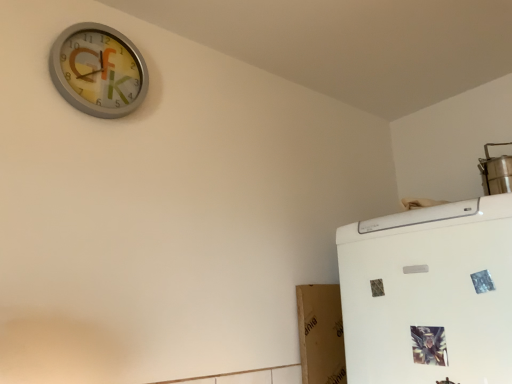
Describe the element at coordinates (98, 70) in the screenshot. This screenshot has width=512, height=384. I see `metallic silver clock at upper left` at that location.

At what (x,y) coordinates should I click in order to perform the action: click on metallic silver clock at upper left. Please return your answer as a coordinate pair (x, y). The height and width of the screenshot is (384, 512). Looking at the image, I should click on (98, 70).

Measure the distance between stainless steel steamer at upper right and camera.

A distance of 1.29 meters exists between stainless steel steamer at upper right and camera.

Locate an element on the screen. stainless steel steamer at upper right is located at coordinates (496, 172).

What do you see at coordinates (496, 172) in the screenshot? I see `stainless steel steamer at upper right` at bounding box center [496, 172].

Find the location of a particular element. metallic silver clock at upper left is located at coordinates (98, 70).

Between stainless steel steamer at upper right and metallic silver clock at upper left, which one appears on the right side from the viewer's perspective?

stainless steel steamer at upper right is more to the right.

Is stainless steel steamer at upper right in front of or behind metallic silver clock at upper left in the image?

In the image, stainless steel steamer at upper right appears behind metallic silver clock at upper left.

Considering the positions of points (498, 185) and (76, 58), is point (498, 185) farther from camera compared to point (76, 58)?

That is True.

From the image's perspective, which is above, stainless steel steamer at upper right or metallic silver clock at upper left?

metallic silver clock at upper left is shown above in the image.

From a real-world perspective, which is physically above, stainless steel steamer at upper right or metallic silver clock at upper left?

metallic silver clock at upper left.

Which object is thinner, stainless steel steamer at upper right or metallic silver clock at upper left?

metallic silver clock at upper left is thinner.

Considering the sizes of objects stainless steel steamer at upper right and metallic silver clock at upper left in the image provided, who is taller, stainless steel steamer at upper right or metallic silver clock at upper left?

With more height is metallic silver clock at upper left.

Who is bigger, stainless steel steamer at upper right or metallic silver clock at upper left?

With larger size is stainless steel steamer at upper right.

Is stainless steel steamer at upper right completely or partially outside of metallic silver clock at upper left?

stainless steel steamer at upper right lies outside metallic silver clock at upper left's area.

Is stainless steel steamer at upper right directly adjacent to metallic silver clock at upper left?

No.

Is metallic silver clock at upper left at the back of stainless steel steamer at upper right?

No, stainless steel steamer at upper right is not facing the opposite direction of metallic silver clock at upper left.

Can you tell me how much stainless steel steamer at upper right and metallic silver clock at upper left differ in facing direction?

stainless steel steamer at upper right and metallic silver clock at upper left are facing 90.3 degrees away from each other.

Measure the distance between stainless steel steamer at upper right and metallic silver clock at upper left.

The distance of stainless steel steamer at upper right from metallic silver clock at upper left is 3.96 feet.

Find the location of a particular element. This screenshot has width=512, height=384. appliance on the right of metallic silver clock at upper left is located at coordinates (496, 172).

Is metallic silver clock at upper left to the right of stainless steel steamer at upper right from the viewer's perspective?

In fact, metallic silver clock at upper left is to the left of stainless steel steamer at upper right.

Considering the positions of objects metallic silver clock at upper left and stainless steel steamer at upper right in the image provided, who is behind, metallic silver clock at upper left or stainless steel steamer at upper right?

stainless steel steamer at upper right is behind.

Is point (138, 81) farther from camera compared to point (484, 185)?

No, (138, 81) is closer to viewer.

From the image's perspective, which one is positioned higher, metallic silver clock at upper left or stainless steel steamer at upper right?

metallic silver clock at upper left.

From a real-world perspective, is metallic silver clock at upper left positioned above or below stainless steel steamer at upper right?

From a real-world perspective, metallic silver clock at upper left is physically above stainless steel steamer at upper right.

Considering the sizes of metallic silver clock at upper left and stainless steel steamer at upper right in the image, is metallic silver clock at upper left wider or thinner than stainless steel steamer at upper right?

In the image, metallic silver clock at upper left appears to be more narrow than stainless steel steamer at upper right.

Which of these two, metallic silver clock at upper left or stainless steel steamer at upper right, stands taller?

metallic silver clock at upper left.

Considering the sizes of metallic silver clock at upper left and stainless steel steamer at upper right in the image, is metallic silver clock at upper left bigger or smaller than stainless steel steamer at upper right?

Considering their sizes, metallic silver clock at upper left takes up less space than stainless steel steamer at upper right.

Would you say metallic silver clock at upper left is outside stainless steel steamer at upper right?

Yes, metallic silver clock at upper left is located beyond the bounds of stainless steel steamer at upper right.

Are metallic silver clock at upper left and stainless steel steamer at upper right located far from each other?

metallic silver clock at upper left is positioned a significant distance from stainless steel steamer at upper right.

In the scene shown: Is metallic silver clock at upper left facing away from stainless steel steamer at upper right?

metallic silver clock at upper left does not have its back to stainless steel steamer at upper right.

How distant is metallic silver clock at upper left from stainless steel steamer at upper right?

A distance of 3.96 feet exists between metallic silver clock at upper left and stainless steel steamer at upper right.

Identify the location of appliance behind the metallic silver clock at upper left. The height and width of the screenshot is (384, 512). (496, 172).

Identify the location of wall clock on the left of stainless steel steamer at upper right. (98, 70).

The image size is (512, 384). I want to click on appliance below the metallic silver clock at upper left (from a real-world perspective), so click(x=496, y=172).